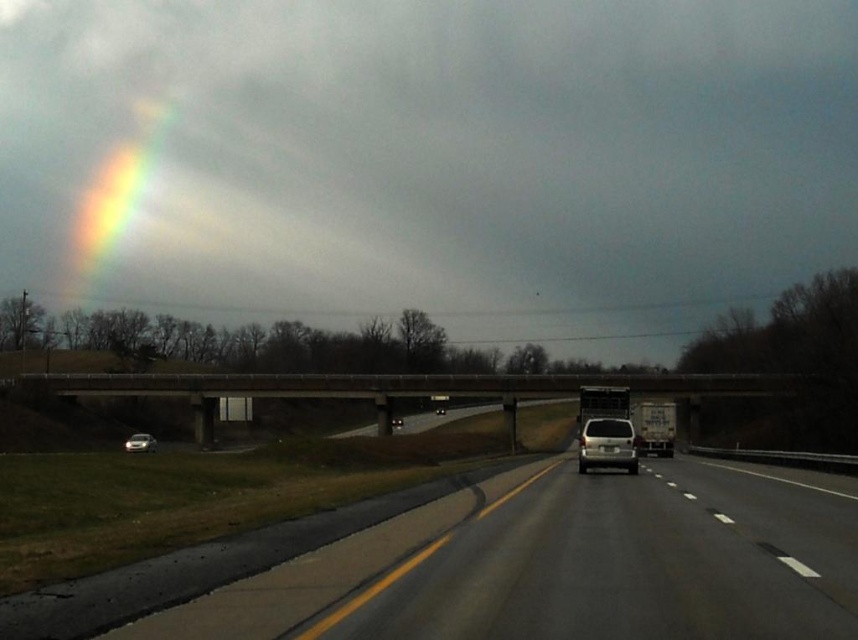
Between rainbow iridescent cloud at upper left and white matte suv at center, which one appears on the left side from the viewer's perspective?

rainbow iridescent cloud at upper left

Between point (106, 173) and point (612, 461), which one is positioned behind?

Point (106, 173)

The height and width of the screenshot is (640, 858). Identify the location of rainbow iridescent cloud at upper left. (115, 193).

Between white glossy car at center and white matte suv at center, which one is positioned lower?

white matte suv at center is below.

Is point (659, 552) positioned before point (609, 445)?

That is True.

Where is `white glossy car at center`? The width and height of the screenshot is (858, 640). white glossy car at center is located at coordinates (502, 566).

Who is taller, white matte suv at center or matte white sedan at center?

With more height is white matte suv at center.

Can you confirm if white matte suv at center is positioned to the right of matte white sedan at center?

Correct, you'll find white matte suv at center to the right of matte white sedan at center.

Which is in front, point (615, 429) or point (445, 410)?

Point (615, 429)

The image size is (858, 640). I want to click on white matte suv at center, so click(x=607, y=444).